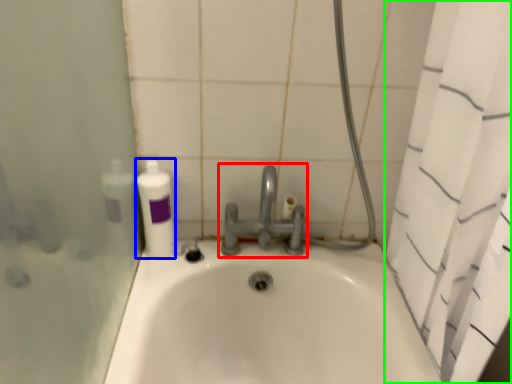
Question: Estimate the real-world distances between objects in this image. Which object is farther from tap (highlighted by a red box), cleaning product (highlighted by a blue box) or shower curtain (highlighted by a green box)?

Choices:
 (A) cleaning product
 (B) shower curtain

Answer: (B)